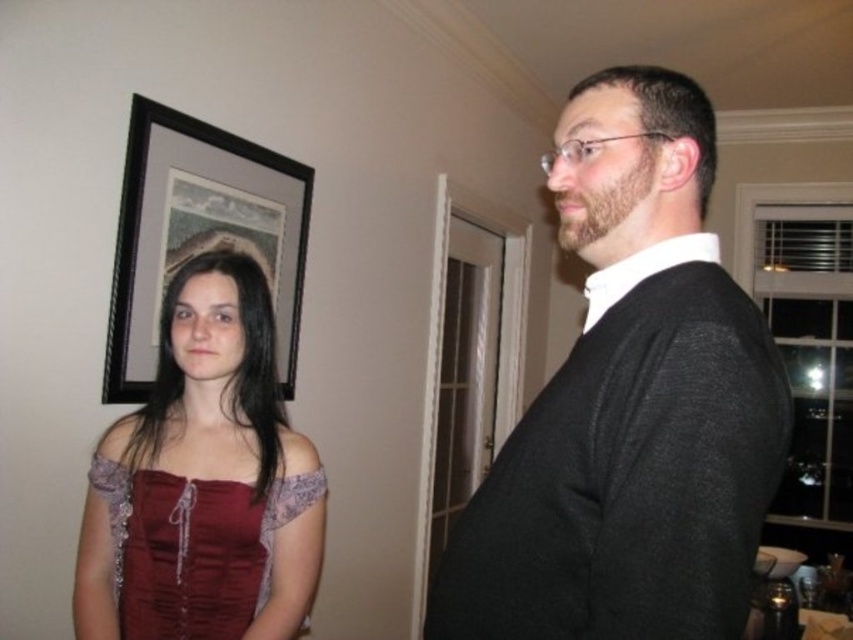
You are a photographer setting up a shoot in the described scene. You need to place a small prop exactly at the point specified in the objects. The prop is a silver star that must be placed at point (204, 481). However, there is an object already present at that location. What object is blocking the placement of the silver star at that coordinate?

The velvet dress at left is blocking the placement of the silver star at point (204, 481).

You are a photographer setting up a shoot in the described scene. You need to place a small prop between the velvet dress at left and the black wood picture frame at upper left. Based on their positions, which object should the prop be closer to?

The velvet dress at left is positioned on the right side of the black wood picture frame at upper left. Therefore, the prop should be placed closer to the velvet dress at left since it is located to the right of the frame.